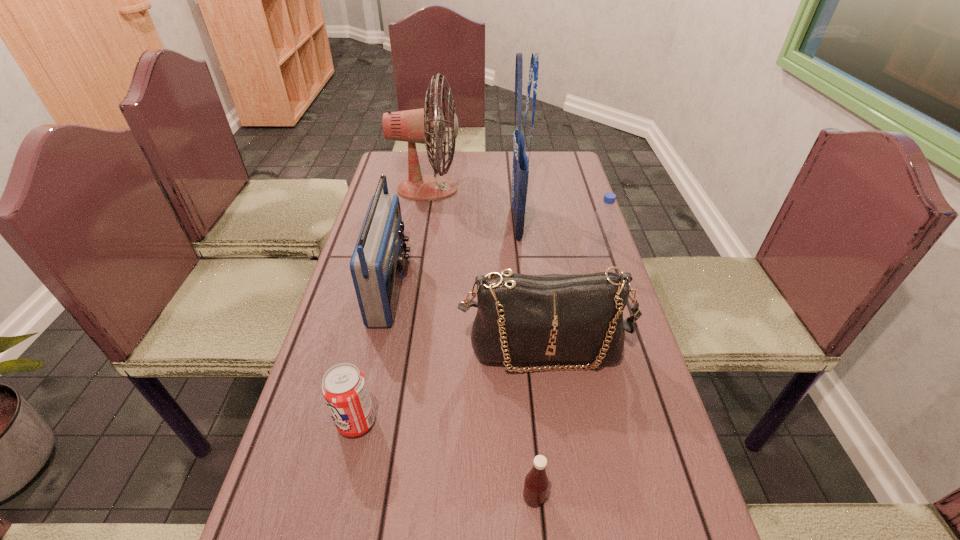
The height and width of the screenshot is (540, 960). In order to click on handbag situated at the right edge in this screenshot , I will do `click(521, 318)`.

Find the location of `bottle that is positioned at the right edge`. bottle that is positioned at the right edge is located at coordinates (599, 244).

Find the location of a particular element. This screenshot has height=540, width=960. object that is at the far left corner is located at coordinates (414, 126).

In the image, there is a desktop. At what (x,y) coordinates should I click in order to perform the action: click on free region at the far edge. Please return your answer as a coordinate pair (x, y). This screenshot has width=960, height=540. Looking at the image, I should click on (495, 165).

This screenshot has width=960, height=540. In order to click on free space at the left edge of the desktop in this screenshot , I will do `click(338, 511)`.

At what (x,y) coordinates should I click in order to perform the action: click on vacant region at the right edge of the desktop. Please return your answer as a coordinate pair (x, y). Looking at the image, I should click on (635, 372).

At what (x,y) coordinates should I click in order to perform the action: click on free space at the far left corner. Please return your answer as a coordinate pair (x, y). This screenshot has width=960, height=540. Looking at the image, I should click on (389, 156).

Locate an element on the screen. This screenshot has width=960, height=540. free spot between the nearest object and the bottle is located at coordinates (564, 379).

The image size is (960, 540). What are the coordinates of `free area in between the handbag and the sixth farthest object` in the screenshot? It's located at (450, 385).

The width and height of the screenshot is (960, 540). In order to click on blank region between the sixth farthest object and the radio receiver in this screenshot , I will do `click(373, 355)`.